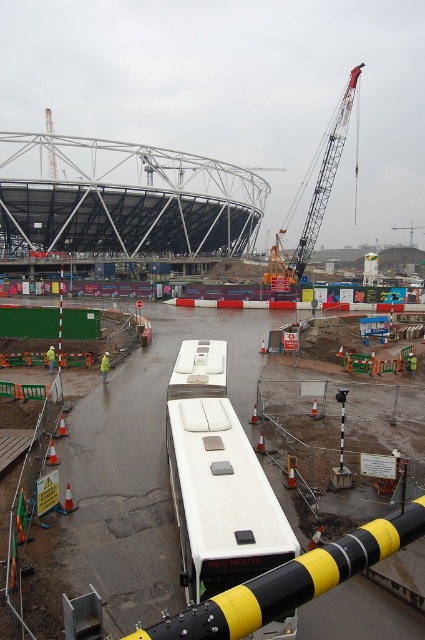
Between white rubber bus at center and metallic gray crane at upper right, which one appears on the right side from the viewer's perspective?

metallic gray crane at upper right

Between white rubber bus at center and metallic gray crane at upper right, which one is positioned higher?

metallic gray crane at upper right is higher up.

Is point (98, 403) positioned before point (342, 118)?

That is True.

You are a GUI agent. You are given a task and a screenshot of the screen. Output one action in this format:
    pyautogui.click(x=<x>, y=<y>)
    Task: Click on the white rubber bus at center
    The width and height of the screenshot is (425, 640).
    Given the screenshot: What is the action you would take?
    pyautogui.click(x=142, y=461)